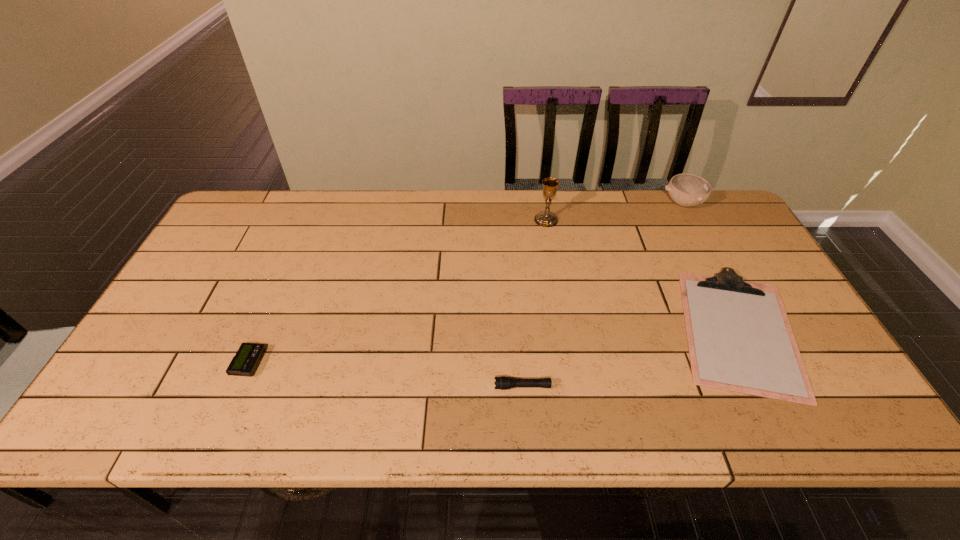
This screenshot has width=960, height=540. Identify the location of object that is at the near right corner. (739, 337).

In the image, there is a desktop. Where is `vacant space at the far edge`? Image resolution: width=960 pixels, height=540 pixels. vacant space at the far edge is located at coordinates (415, 200).

Locate an element on the screen. The height and width of the screenshot is (540, 960). vacant space at the near edge of the desktop is located at coordinates (492, 398).

Where is `vacant space at the left edge of the desktop`? This screenshot has height=540, width=960. vacant space at the left edge of the desktop is located at coordinates (193, 290).

Where is `free spot at the right edge of the desktop`? The height and width of the screenshot is (540, 960). free spot at the right edge of the desktop is located at coordinates (741, 273).

This screenshot has height=540, width=960. In the image, there is a desktop. In order to click on blank space at the far left corner in this screenshot , I will do `click(250, 191)`.

Identify the location of vacant area between the beeper and the bowl. (467, 283).

This screenshot has height=540, width=960. In order to click on empty space between the tallest object and the bowl in this screenshot , I will do `click(614, 212)`.

Find the location of `vacant space that is in between the bowl and the third object from left to right`. vacant space that is in between the bowl and the third object from left to right is located at coordinates (614, 212).

This screenshot has width=960, height=540. I want to click on free space between the leftmost object and the flashlight, so click(x=386, y=375).